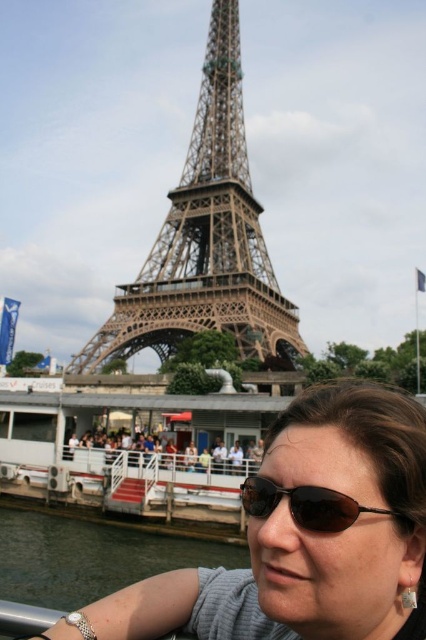
You are on a boat near the Eiffel Tower and want to take a photo of the tower. You notice two points marked on your camera screen at coordinates point (250,292) and point (348,502). Which point is closer to the Eiffel Tower in the background?

Point (348,502) is closer to the Eiffel Tower in the background because point (250,292) is behind it.

You are on a boat near the Eiffel Tower and want to know which of the two points, point (399, 548) or point (270, 484), is closer to you. Based on the coordinates given, can you determine which point is nearer?

Point (399, 548) is closer to the viewer than point (270, 484).

Looking at this image, you are on a boat in Paris and want to take a photo of the green patina metal eiffel tower at center while also including the black plastic sunglasses at lower center in the frame. Based on their positions, will the Eiffel Tower appear to the left or right of the sunglasses in the photo?

The green patina metal eiffel tower at center is positioned on the left side of black plastic sunglasses at lower center, so in the photo, the Eiffel Tower will appear to the left of the sunglasses.